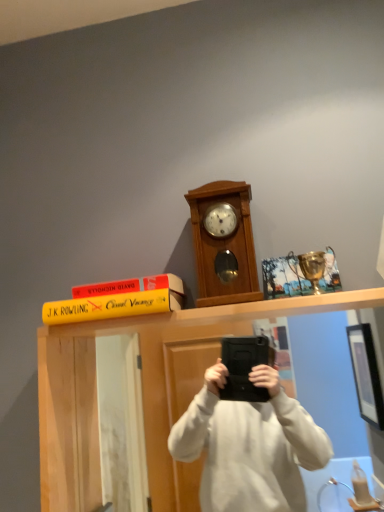
Question: From a real-world perspective, is yellow matte book at upper center positioned under yellow matte book at upper center based on gravity?

Choices:
 (A) yes
 (B) no

Answer: (A)

Question: Does yellow matte book at upper center have a lesser width compared to yellow matte book at upper center?

Choices:
 (A) no
 (B) yes

Answer: (B)

Question: Does yellow matte book at upper center have a larger size compared to yellow matte book at upper center?

Choices:
 (A) no
 (B) yes

Answer: (B)

Question: From the image's perspective, is yellow matte book at upper center on yellow matte book at upper center?

Choices:
 (A) yes
 (B) no

Answer: (B)

Question: From a real-world perspective, is yellow matte book at upper center located higher than yellow matte book at upper center?

Choices:
 (A) no
 (B) yes

Answer: (A)

Question: Is yellow matte book at upper center outside yellow matte book at upper center?

Choices:
 (A) yes
 (B) no

Answer: (A)

Question: Is yellow matte book at upper center inside wooden clock at center?

Choices:
 (A) no
 (B) yes

Answer: (A)

Question: Is wooden clock at center smaller than yellow matte book at upper center?

Choices:
 (A) no
 (B) yes

Answer: (B)

Question: Can you confirm if wooden clock at center is taller than yellow matte book at upper center?

Choices:
 (A) no
 (B) yes

Answer: (A)

Question: Is wooden clock at center looking in the opposite direction of yellow matte book at upper center?

Choices:
 (A) yes
 (B) no

Answer: (B)

Question: Is wooden clock at center wider than yellow matte book at upper center?

Choices:
 (A) no
 (B) yes

Answer: (A)

Question: From the image's perspective, is wooden clock at center over yellow matte book at upper center?

Choices:
 (A) yes
 (B) no

Answer: (A)

Question: Is yellow matte book at upper center not within wooden clock at center?

Choices:
 (A) no
 (B) yes

Answer: (B)